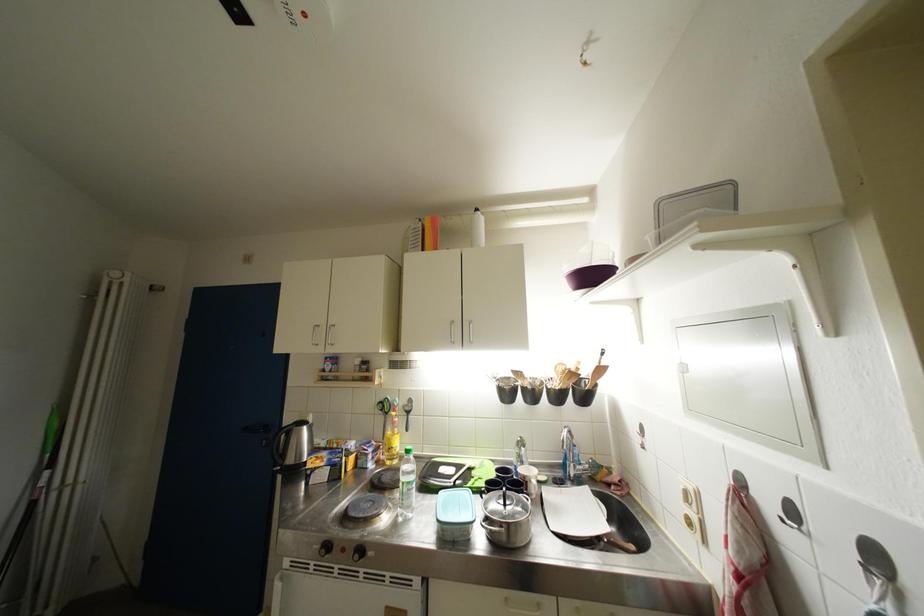
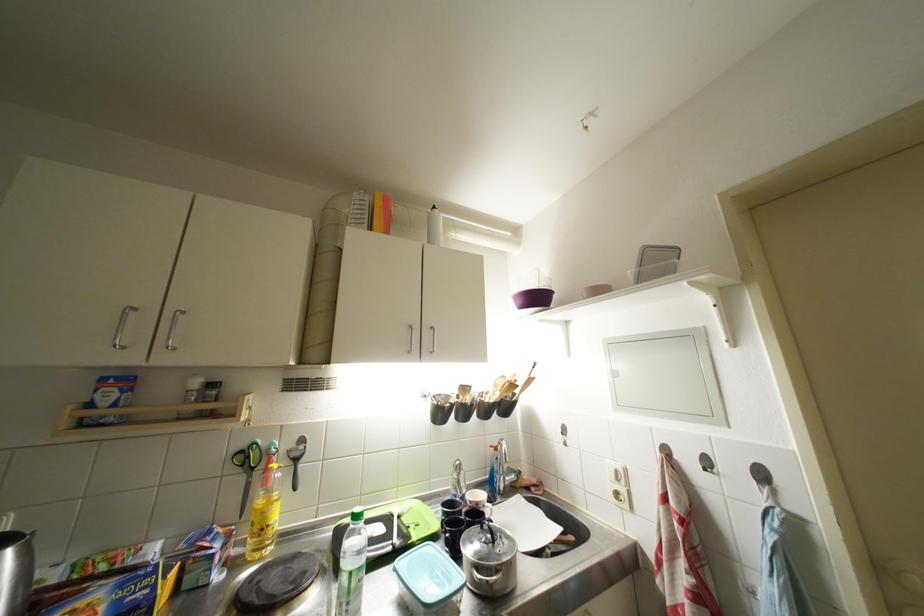
Locate, in the second image, the point that corresponds to (x=396, y=444) in the first image.

(271, 517)